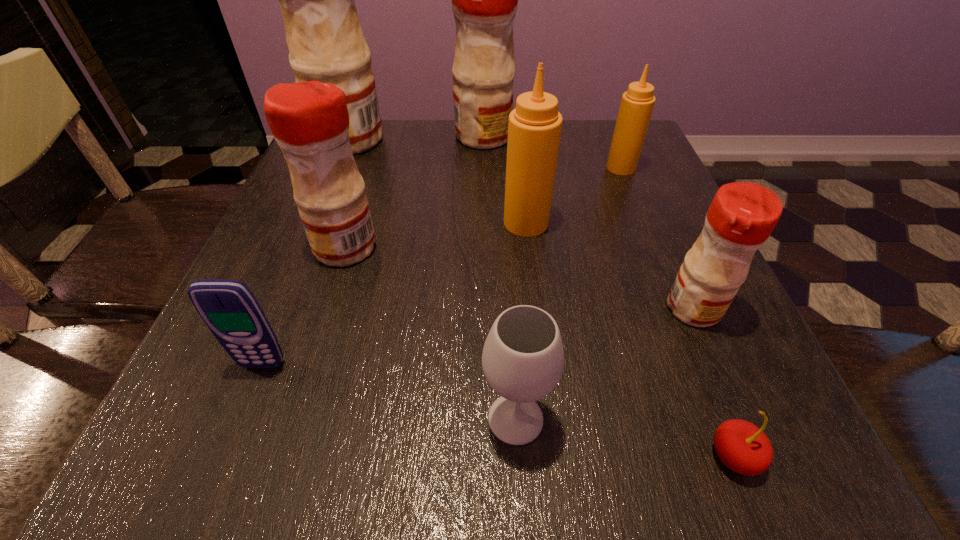
You are a GUI agent. You are given a task and a screenshot of the screen. Output one action in this format:
    pyautogui.click(x=<x>, y=<y>)
    Task: Click on the object that is positioned at the near right corner
    This screenshot has height=540, width=960.
    Given the screenshot: What is the action you would take?
    pyautogui.click(x=744, y=448)

I want to click on free spot at the far edge of the desktop, so click(571, 123).

Where is `free space at the near edge of the desktop`? free space at the near edge of the desktop is located at coordinates (446, 426).

Locate an element on the screen. The image size is (960, 540). free spot at the left edge of the desktop is located at coordinates (245, 390).

The width and height of the screenshot is (960, 540). In order to click on vacant space at the right edge of the desktop in this screenshot , I will do `click(733, 335)`.

Locate an element on the screen. free location at the near left corner of the desktop is located at coordinates (212, 477).

The image size is (960, 540). In the image, there is a desktop. In order to click on vacant space at the near right corner in this screenshot , I will do `click(702, 430)`.

Locate an element on the screen. This screenshot has height=540, width=960. free space between the third biggest red condiment and the fifth shortest condiment is located at coordinates (415, 192).

Locate an element on the screen. This screenshot has height=540, width=960. vacant space that is in between the wineglass and the right tan condiment is located at coordinates (568, 293).

What are the coordinates of `free spot between the tallest object and the third red condiment from left to right` in the screenshot? It's located at (417, 138).